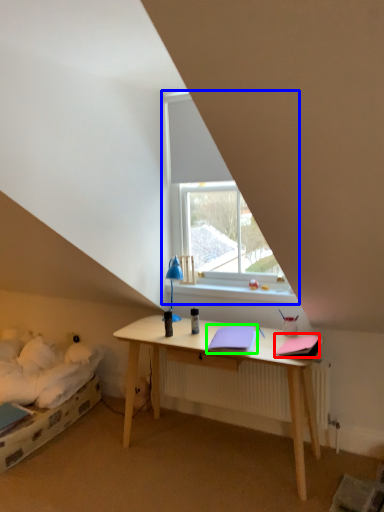
Question: Which object is the farthest from notebook (highlighted by a red box)? Choose among these: window (highlighted by a blue box) or notebook (highlighted by a green box).

Choices:
 (A) window
 (B) notebook

Answer: (A)